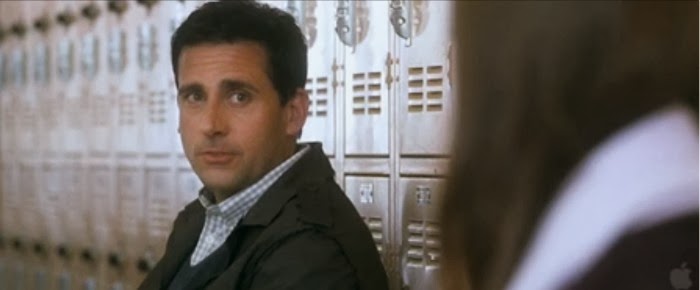
Find the location of a particular element. The width and height of the screenshot is (700, 290). handle is located at coordinates (340, 17).